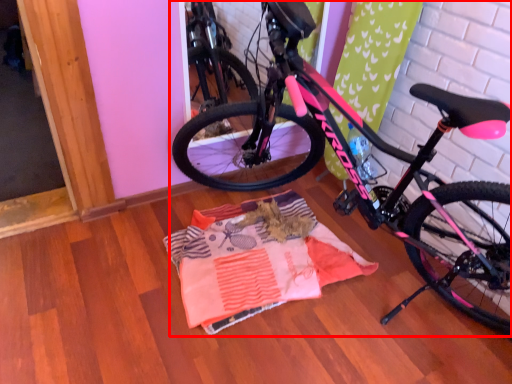
Question: From the image's perspective, where is bicycle (annotated by the red box) located in relation to blanket in the image?

Choices:
 (A) above
 (B) below

Answer: (A)